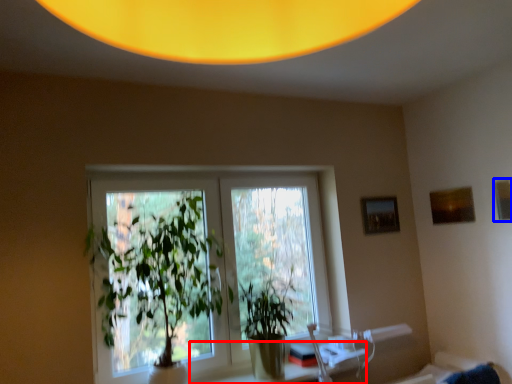
Question: Which of the following is the farthest to the observer, table (highlighted by a red box) or picture frame (highlighted by a blue box)?

Choices:
 (A) table
 (B) picture frame

Answer: (B)